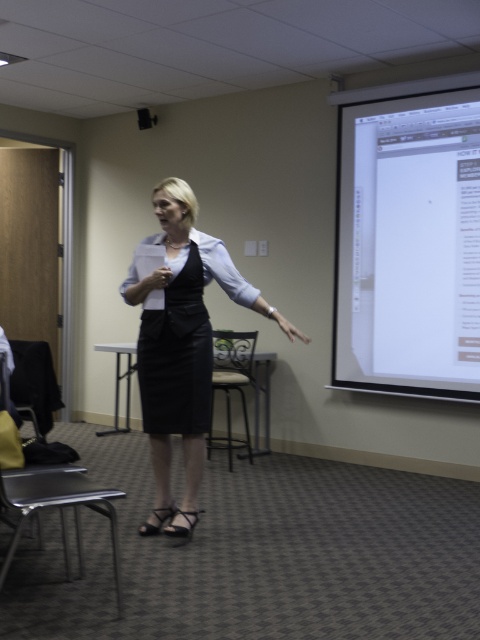
Question: Is white glossy projection screen at upper right above black satin skirt at center?

Choices:
 (A) yes
 (B) no

Answer: (A)

Question: Can you confirm if white glossy projection screen at upper right is positioned above beige fabric chair at center?

Choices:
 (A) no
 (B) yes

Answer: (B)

Question: Is black satin skirt at center to the right of black leather dress at center from the viewer's perspective?

Choices:
 (A) no
 (B) yes

Answer: (B)

Question: Which point is closer to the camera?

Choices:
 (A) (382, 266)
 (B) (175, 273)

Answer: (B)

Question: Which point is farther to the camera?

Choices:
 (A) (145, 326)
 (B) (404, 154)

Answer: (B)

Question: Estimate the real-world distances between objects in this image. Which object is farther from the beige fabric chair at center?

Choices:
 (A) black satin skirt at center
 (B) black leather dress at center

Answer: (A)